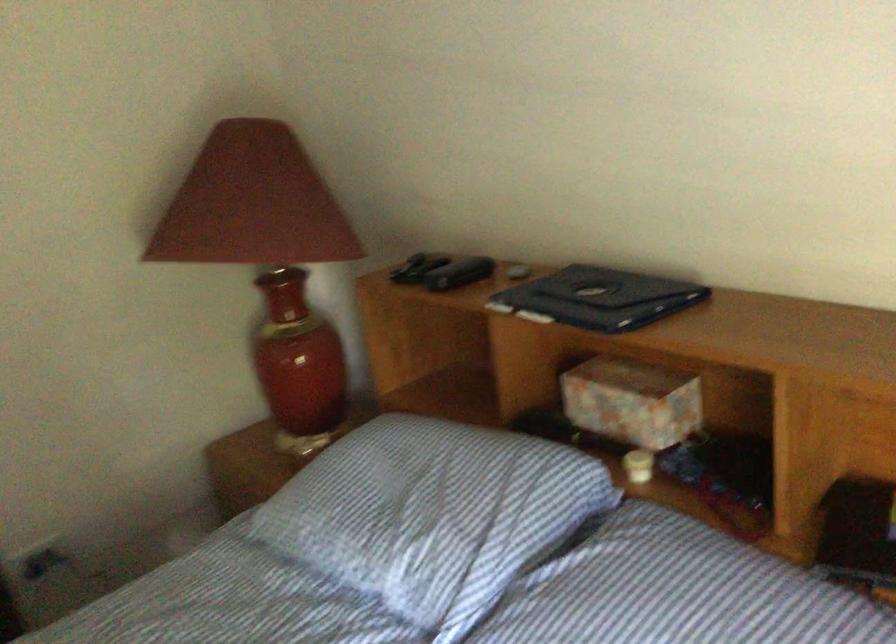
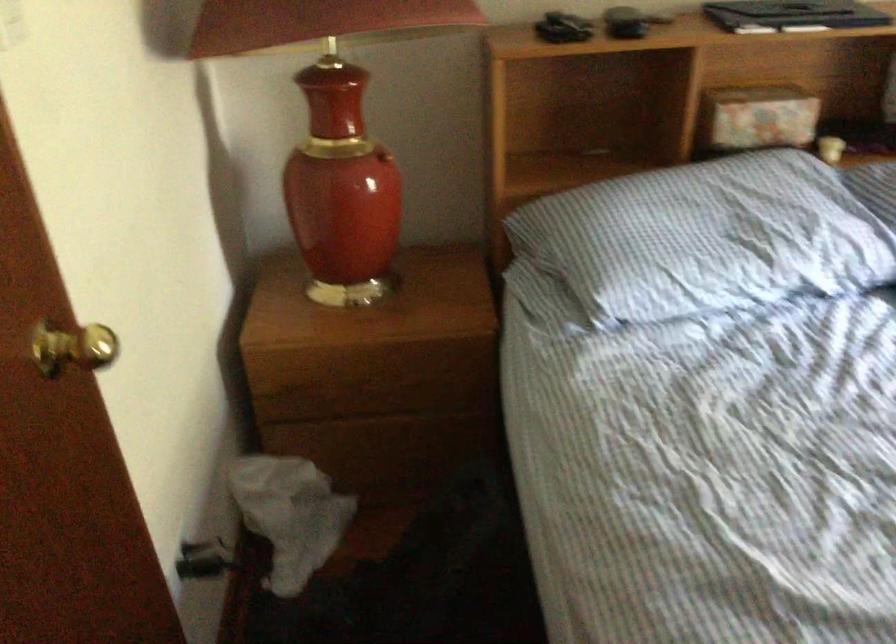
In the second image, find the point that corresponds to point 371,489 in the first image.

(707, 238)